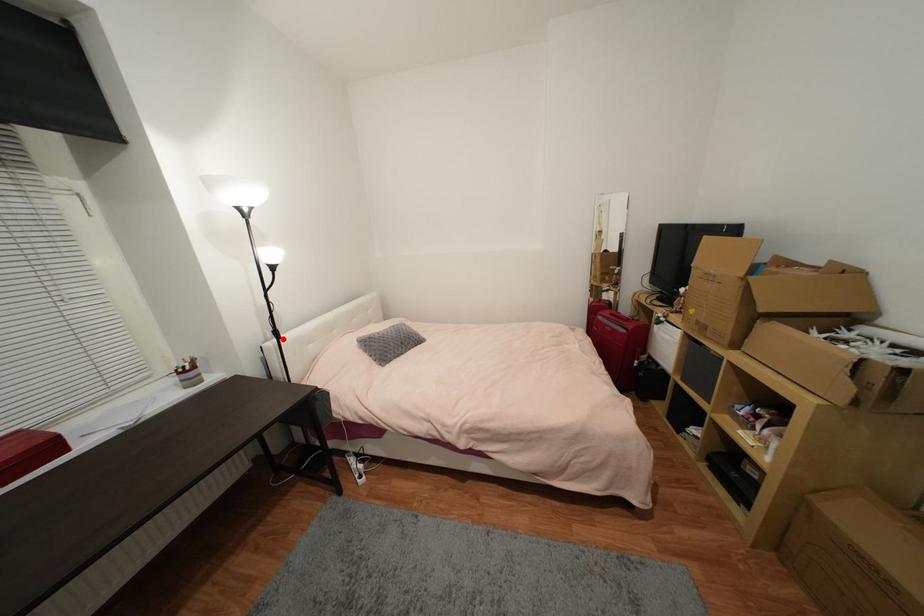
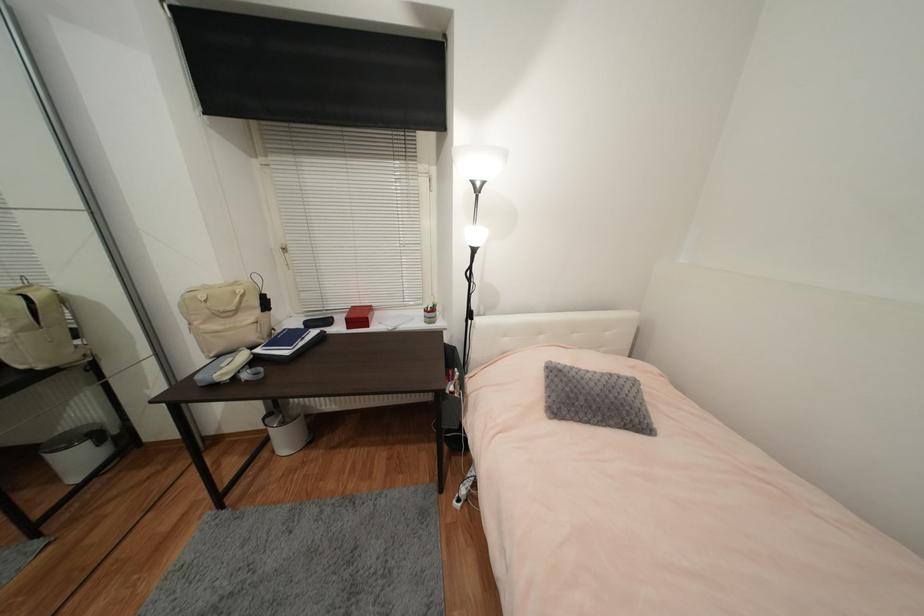
Question: I am providing you with two images of the same scene from different viewpoints. In image1, a red point is highlighted. Considering the same 3D point in image2, which of the following is correct?

Choices:
 (A) It is closer
 (B) It is farther

Answer: (B)